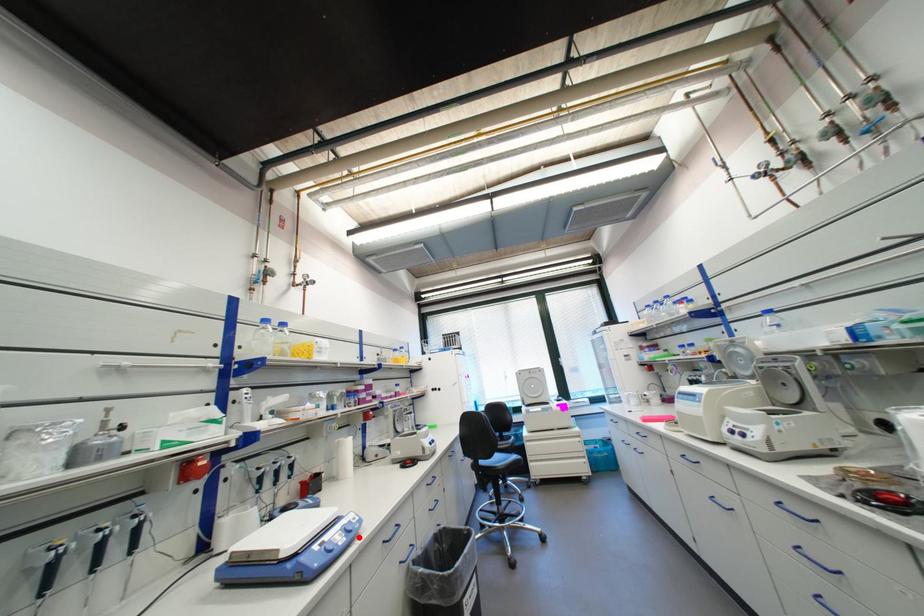
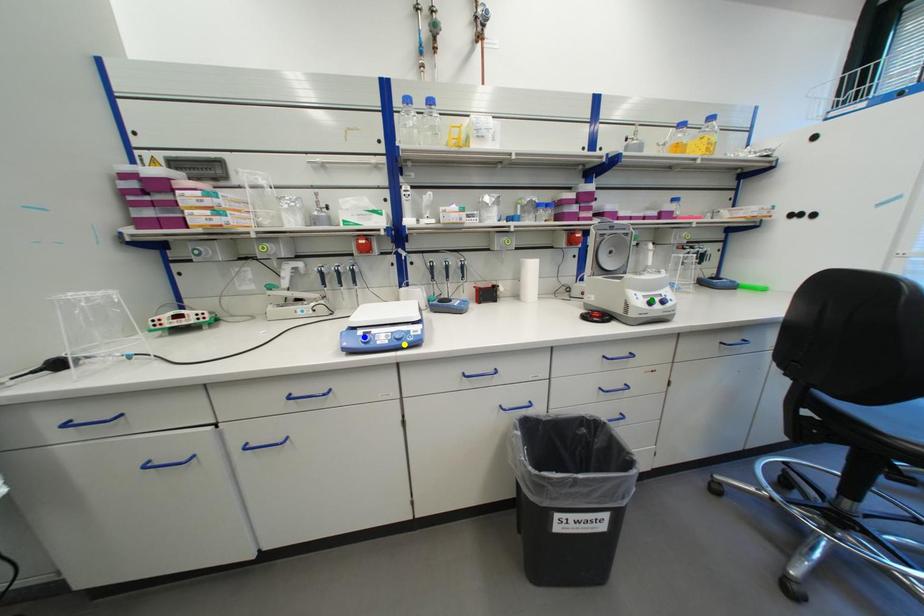
Question: I am providing you with two images of the same scene from different viewpoints. A red point is marked on the first image. You are given multiple points on the second image. Can you choose the point in image 2 that corresponds to the point in image 1?

Choices:
 (A) blue point
 (B) green point
 (C) yellow point

Answer: (C)